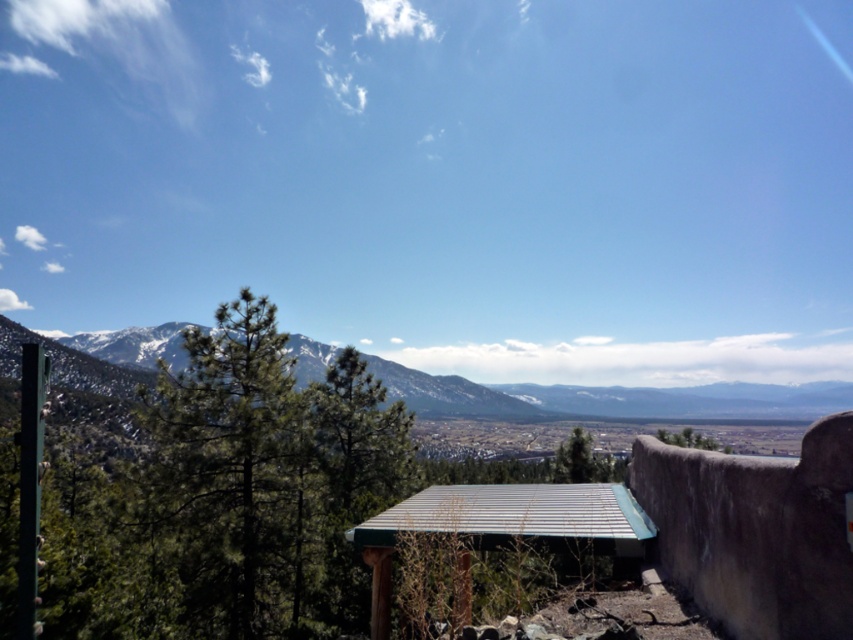
From the picture: You are planning to place a new bench in the scenic landscape. The bench requires a spot that is not under any tree. Given the green textured pine tree at center and the green matte tree at center, which tree would allow more open space around it for the bench?

The green matte tree at center is larger, so placing the bench near it would leave less open space. The green textured pine tree at center is smaller and would provide more open space for the bench.

From the picture: You are an environmental scientist studying the layers of vegetation in the mountain landscape. You observe the green textured pine tree at center and the green matte tree at center. Which tree is located higher up in the vegetation layers?

The green textured pine tree at center is positioned over the green matte tree at center, meaning it is higher up in the vegetation layers.

You are standing in the scenic landscape and want to take a photo of both the green textured pine tree at center and the green matte tree at center. Which tree should you position to your left to include both in the frame?

You should position the green textured pine tree at center to your left because it is already to the left of the green matte tree at center in the scene.